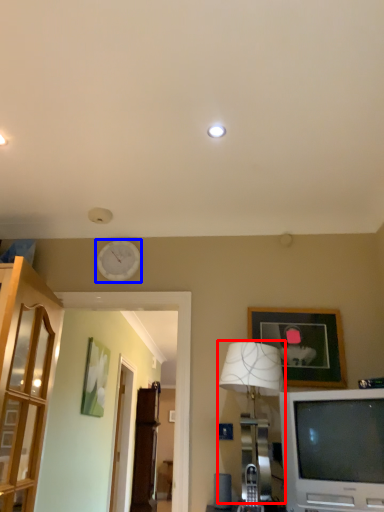
Question: Which point is further to the camera, lamp (highlighted by a red box) or clock (highlighted by a blue box)?

Choices:
 (A) lamp
 (B) clock

Answer: (B)